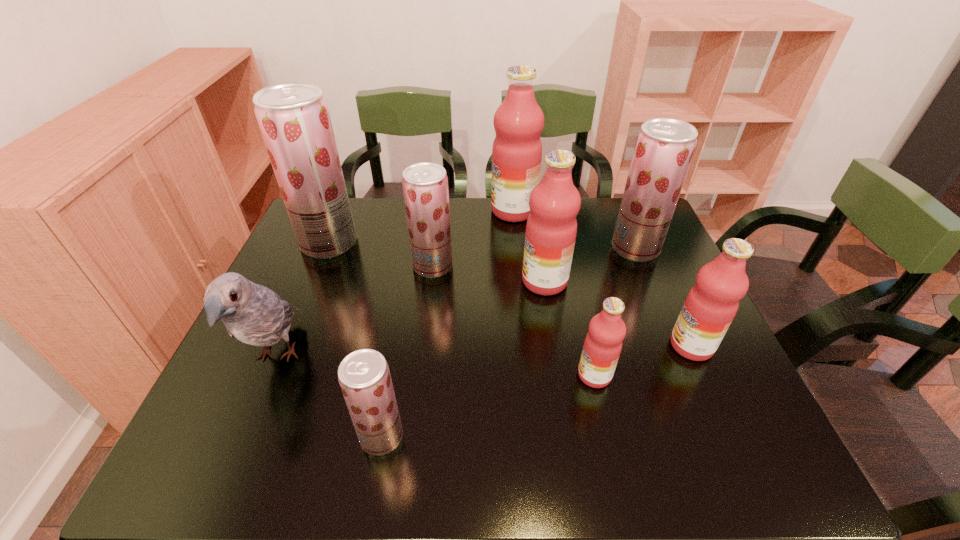
Find the location of a particular element. vacant space located on the right of the second smallest strawberry fruit juice is located at coordinates (533, 266).

I want to click on free region located 0.260m on the label of the rightmost pink fruit juice, so click(561, 346).

Locate an element on the screen. The width and height of the screenshot is (960, 540). vacant space situated 0.340m on the label of the rightmost pink fruit juice is located at coordinates (527, 346).

Identify the location of vacant space located on the label of the rightmost pink fruit juice. (556, 346).

Where is `vacant region located 0.100m on the front-facing side of the parrot`? vacant region located 0.100m on the front-facing side of the parrot is located at coordinates (237, 451).

You are a GUI agent. You are given a task and a screenshot of the screen. Output one action in this format:
    pyautogui.click(x=<x>, y=<y>)
    Task: Click on the free space located 0.090m on the label of the smallest pink fruit juice
    This screenshot has width=960, height=540.
    Given the screenshot: What is the action you would take?
    pyautogui.click(x=538, y=375)

In order to click on free space located on the label of the smallest pink fruit juice in this screenshot , I will do `click(555, 375)`.

The width and height of the screenshot is (960, 540). Identify the location of blank space located 0.280m on the label of the smallest pink fruit juice. (452, 375).

Image resolution: width=960 pixels, height=540 pixels. I want to click on free space located on the right of the nearest strawberry fruit juice, so click(599, 436).

This screenshot has width=960, height=540. What are the coordinates of `object at the near edge` in the screenshot? It's located at (364, 376).